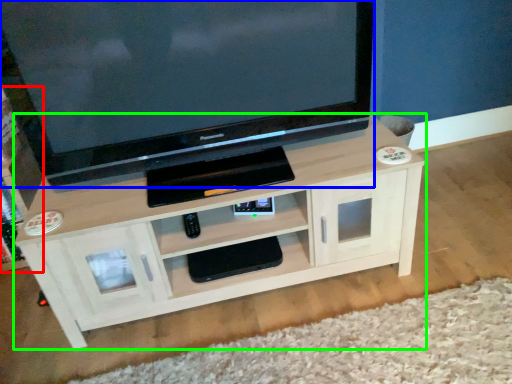
Question: Which is nearer to the tv cabinet (highlighted by a red box)? television (highlighted by a blue box) or shelf (highlighted by a green box).

Choices:
 (A) television
 (B) shelf

Answer: (A)